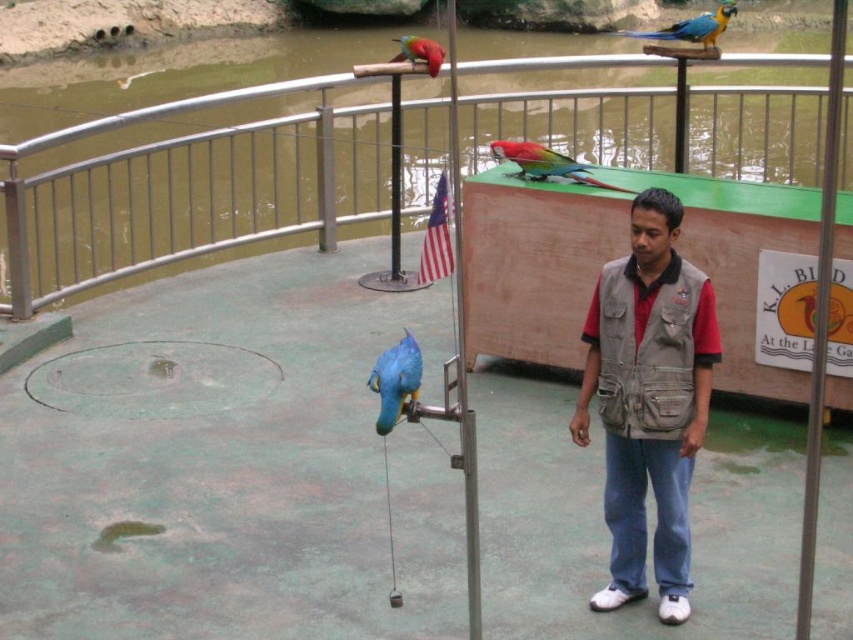
Question: Is green matte parrot at center above shiny red parrot at upper center?

Choices:
 (A) yes
 (B) no

Answer: (B)

Question: Among these points, which one is farthest from the camera?

Choices:
 (A) (397, 36)
 (B) (845, 1)
 (C) (390, 417)
 (D) (672, 26)

Answer: (A)

Question: Which object is the closest to the khaki fabric vest at center?

Choices:
 (A) shiny red parrot at upper center
 (B) blue glossy parrot at center

Answer: (B)

Question: In this image, where is khaki fabric vest at center located relative to brushed metal pole at center right?

Choices:
 (A) left
 (B) right

Answer: (A)

Question: Is brushed metal rail at upper center bigger than brushed metal pole at center?

Choices:
 (A) yes
 (B) no

Answer: (A)

Question: Among these objects, which one is farthest from the camera?

Choices:
 (A) khaki fabric vest at center
 (B) brushed metal pole at center right
 (C) blue glossy parrot at upper center

Answer: (C)